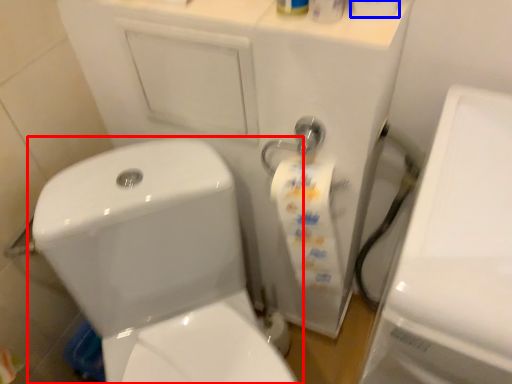
Question: Which object appears closest to the camera in this image, toilet (highlighted by a red box) or toilet paper (highlighted by a blue box)?

Choices:
 (A) toilet
 (B) toilet paper

Answer: (B)